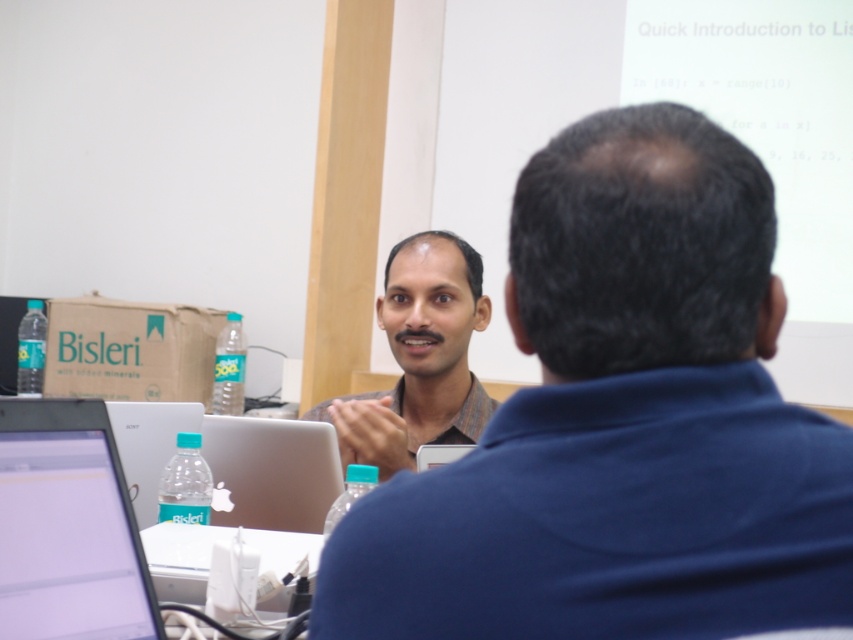
Can you confirm if matte brown shirt at center is wider than satin silver laptop at center?

Yes.

Consider the image. Between matte brown shirt at center and satin silver laptop at center, which one appears on the left side from the viewer's perspective?

Positioned to the left is satin silver laptop at center.

What are the coordinates of `matte brown shirt at center` in the screenshot? It's located at (419, 356).

Consider the image. Can you confirm if matte black shirt at center is positioned below silver metallic laptop at lower left?

No, matte black shirt at center is not below silver metallic laptop at lower left.

Does matte black shirt at center have a lesser width compared to silver metallic laptop at lower left?

Incorrect, matte black shirt at center's width is not less than silver metallic laptop at lower left's.

Where is `matte black shirt at center`? The width and height of the screenshot is (853, 640). matte black shirt at center is located at coordinates pos(621,422).

Identify the location of matte black shirt at center. (621, 422).

Is matte black shirt at center positioned at the back of silver metallic laptop at center?

No, matte black shirt at center is in front of silver metallic laptop at center.

Where is `matte black shirt at center`? matte black shirt at center is located at coordinates (621, 422).

What do you see at coordinates (621, 422) in the screenshot?
I see `matte black shirt at center` at bounding box center [621, 422].

I want to click on matte black shirt at center, so click(621, 422).